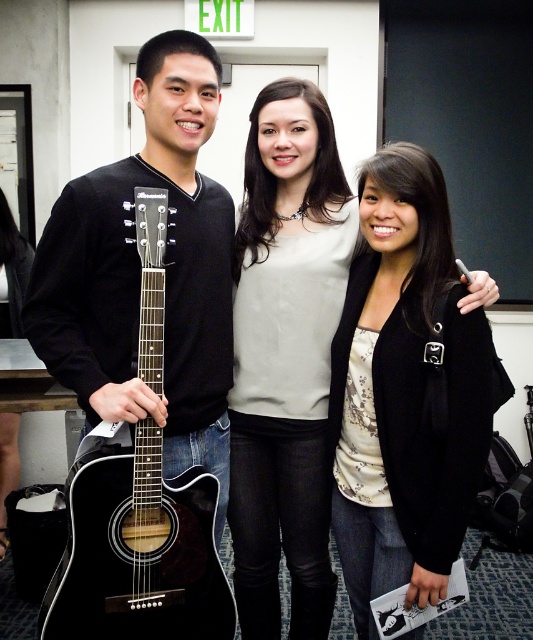
Can you confirm if black matte jacket at center is bigger than black acoustic guitar at left?

Indeed, black matte jacket at center has a larger size compared to black acoustic guitar at left.

From the picture: Does black matte jacket at center come behind black acoustic guitar at left?

Yes.

This screenshot has width=533, height=640. What are the coordinates of `black matte jacket at center` in the screenshot? It's located at (406, 392).

Does matte white blouse at center have a lesser height compared to black acoustic guitar at left?

Incorrect, matte white blouse at center's height does not fall short of black acoustic guitar at left's.

Is matte white blouse at center below black acoustic guitar at left?

Actually, matte white blouse at center is above black acoustic guitar at left.

Does point (270, 152) come farther from viewer compared to point (119, 499)?

Yes, it is.

Where is `matte white blouse at center`? matte white blouse at center is located at coordinates (286, 356).

Between point (474, 378) and point (306, 104), which one is positioned behind?

Positioned behind is point (306, 104).

Does black matte jacket at center appear on the left side of matte white blouse at center?

No, black matte jacket at center is not to the left of matte white blouse at center.

What are the coordinates of `black matte jacket at center` in the screenshot? It's located at (406, 392).

Locate an element on the screen. black matte jacket at center is located at coordinates (406, 392).